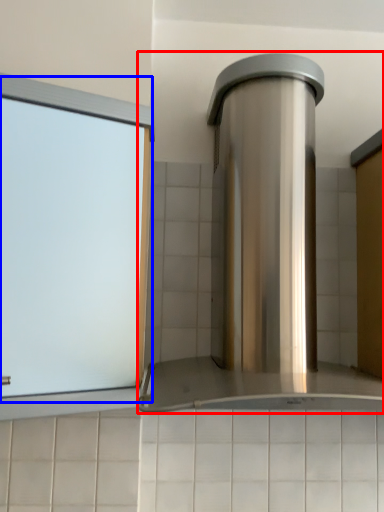
Question: Which object is further to the camera taking this photo, home appliance (highlighted by a red box) or window (highlighted by a blue box)?

Choices:
 (A) home appliance
 (B) window

Answer: (B)